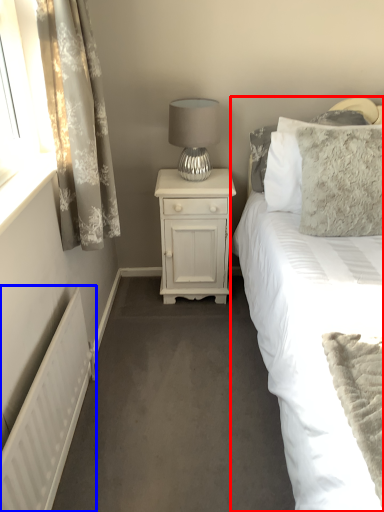
Question: Which of the following is the farthest to the observer, bed (highlighted by a red box) or radiator (highlighted by a blue box)?

Choices:
 (A) bed
 (B) radiator

Answer: (B)